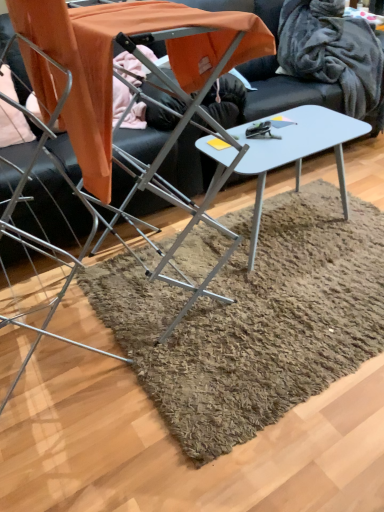
Question: Which direction should I rotate to face light gray plastic table at center, which is counted as the second table, starting from the front, — up or down?

Choices:
 (A) down
 (B) up

Answer: (B)

Question: Is metallic silver chair at left positioned in front of light gray plastic table at center, which is counted as the second table, starting from the front?

Choices:
 (A) no
 (B) yes

Answer: (B)

Question: Is metallic silver chair at left not close to light gray plastic table at center, which is counted as the second table, starting from the front?

Choices:
 (A) yes
 (B) no

Answer: (B)

Question: Can you confirm if metallic silver chair at left is wider than light gray plastic table at center, which is counted as the second table, starting from the front?

Choices:
 (A) yes
 (B) no

Answer: (A)

Question: Can you confirm if metallic silver chair at left is bigger than light gray plastic table at center, the 1th table when ordered from back to front?

Choices:
 (A) yes
 (B) no

Answer: (B)

Question: From a real-world perspective, is metallic silver chair at left physically above light gray plastic table at center, the 1th table when ordered from back to front?

Choices:
 (A) no
 (B) yes

Answer: (B)

Question: Does metallic silver chair at left appear on the right side of light gray plastic table at center, the 1th table when ordered from back to front?

Choices:
 (A) no
 (B) yes

Answer: (A)

Question: Is metallic gray table at center, the 1th table from the front, beside light gray plastic table at center, which is counted as the second table, starting from the front?

Choices:
 (A) no
 (B) yes

Answer: (A)

Question: Is metallic gray table at center, arranged as the 2th table when viewed from the back, thinner than light gray plastic table at center, the 1th table when ordered from back to front?

Choices:
 (A) no
 (B) yes

Answer: (A)

Question: Is metallic gray table at center, arranged as the 2th table when viewed from the back, at the left side of light gray plastic table at center, which is counted as the second table, starting from the front?

Choices:
 (A) yes
 (B) no

Answer: (A)

Question: Is metallic gray table at center, arranged as the 2th table when viewed from the back, positioned behind light gray plastic table at center, the 1th table when ordered from back to front?

Choices:
 (A) yes
 (B) no

Answer: (B)

Question: Is metallic gray table at center, arranged as the 2th table when viewed from the back, turned away from light gray plastic table at center, the 1th table when ordered from back to front?

Choices:
 (A) no
 (B) yes

Answer: (A)

Question: Considering the relative sizes of metallic gray table at center, the 1th table from the front, and light gray plastic table at center, the 1th table when ordered from back to front, in the image provided, is metallic gray table at center, the 1th table from the front, taller than light gray plastic table at center, the 1th table when ordered from back to front,?

Choices:
 (A) no
 (B) yes

Answer: (B)

Question: Are metallic gray table at center, arranged as the 2th table when viewed from the back, and metallic silver chair at left far apart?

Choices:
 (A) no
 (B) yes

Answer: (A)